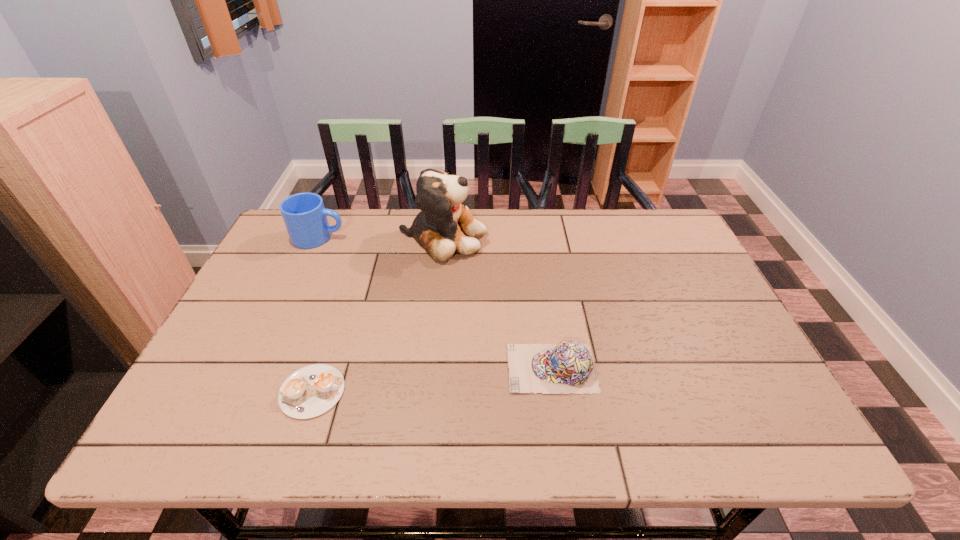
The height and width of the screenshot is (540, 960). I want to click on free space between the mug and the shortest object, so click(x=316, y=314).

The image size is (960, 540). I want to click on free point between the cappuccino and the tallest object, so click(377, 314).

Select which object is the third closest to the mug. Please provide its 2D coordinates. Your answer should be formatted as a tuple, i.e. [(x, y)], where the tuple contains the x and y coordinates of a point satisfying the conditions above.

[(568, 367)]

Find the location of a particular element. The image size is (960, 540). object that ranks as the third closest to the third object from left to right is located at coordinates (311, 391).

Find the location of `vacant space that satisfies the following two spatial constraints: 1. on the side of the shortest object with the handle; 2. on the right side of the mug`. vacant space that satisfies the following two spatial constraints: 1. on the side of the shortest object with the handle; 2. on the right side of the mug is located at coordinates (250, 391).

Locate an element on the screen. free space in the image that satisfies the following two spatial constraints: 1. on the side of the third shortest object with the handle; 2. on the right side of the shortest object is located at coordinates (250, 391).